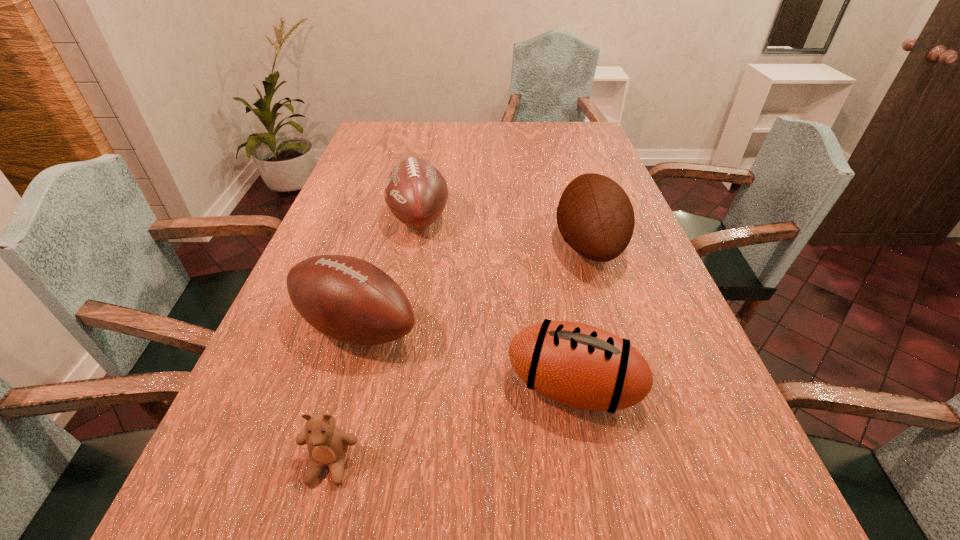
The width and height of the screenshot is (960, 540). I want to click on the fourth tallest object, so click(x=579, y=365).

Where is `teddy bear`? This screenshot has width=960, height=540. teddy bear is located at coordinates (327, 444).

The height and width of the screenshot is (540, 960). In order to click on the shortest object in this screenshot , I will do `click(327, 444)`.

Where is `free space located 0.130m on the left of the shortest football (American)`? The height and width of the screenshot is (540, 960). free space located 0.130m on the left of the shortest football (American) is located at coordinates (x=438, y=388).

The height and width of the screenshot is (540, 960). I want to click on football (American) that is positioned at the left edge, so click(348, 299).

The image size is (960, 540). What are the coordinates of `teddy bear present at the left edge` in the screenshot? It's located at (327, 444).

Locate an element on the screen. The height and width of the screenshot is (540, 960). free spot at the left edge of the desktop is located at coordinates (349, 214).

Find the location of a particular element. The width and height of the screenshot is (960, 540). blank space at the right edge of the desktop is located at coordinates (660, 357).

The height and width of the screenshot is (540, 960). What are the coordinates of `object identified as the third closest to the shortest football (American)` in the screenshot? It's located at (327, 444).

This screenshot has width=960, height=540. In order to click on the third closest object to the shortest object in this screenshot , I will do 416,192.